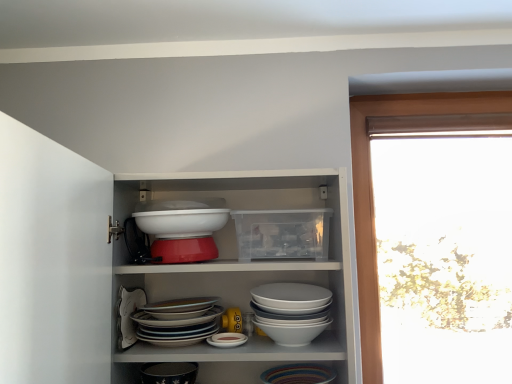
The height and width of the screenshot is (384, 512). What do you see at coordinates (169, 373) in the screenshot?
I see `matte black bowl at lower center` at bounding box center [169, 373].

What is the approximate height of matte black bowl at lower center?

It is 2.81 inches.

Locate an element on the screen. Image resolution: width=512 pixels, height=384 pixels. white glossy bowl at center, which appears as the 3th bowl when ordered from the bottom is located at coordinates (181, 222).

The image size is (512, 384). What do you see at coordinates (291, 311) in the screenshot?
I see `white glossy bowls at center, the 2th bowl when ordered from top to bottom` at bounding box center [291, 311].

You are a GUI agent. You are given a task and a screenshot of the screen. Output one action in this format:
    pyautogui.click(x=<x>, y=<y>)
    Task: Click on the white glossy bowl at center, the 3th bowl in the top-to-bottom sequence
    Image resolution: width=512 pixels, height=384 pixels.
    Given the screenshot: What is the action you would take?
    pyautogui.click(x=177, y=327)

Where is `matte black bowl at lower center`? matte black bowl at lower center is located at coordinates (169, 373).

How different are the orientations of matte black bowl at lower center and white glossy bowl at center, the 3th bowl in the top-to-bottom sequence, in degrees?

0.000886 degrees.

How much distance is there between matte black bowl at lower center and white glossy bowl at center, the 3th bowl in the top-to-bottom sequence?

matte black bowl at lower center is 9.70 centimeters from white glossy bowl at center, the 3th bowl in the top-to-bottom sequence.

From the image's perspective, which object appears higher, matte black bowl at lower center or white glossy bowl at center, the 3th bowl in the top-to-bottom sequence?

white glossy bowl at center, the 3th bowl in the top-to-bottom sequence.

Consider the image. Can we say matte black bowl at lower center lies outside white glossy bowl at center, which ranks as the 1th bowl in bottom-to-top order?

Yes, matte black bowl at lower center is outside of white glossy bowl at center, which ranks as the 1th bowl in bottom-to-top order.

From the image's perspective, is white glossy bowl at center, which ranks as the 1th bowl in bottom-to-top order, located above matte black bowl at lower center?

Yes, from the image's perspective, white glossy bowl at center, which ranks as the 1th bowl in bottom-to-top order, is over matte black bowl at lower center.

Considering the relative sizes of white glossy bowl at center, which ranks as the 1th bowl in bottom-to-top order, and matte black bowl at lower center in the image provided, is white glossy bowl at center, which ranks as the 1th bowl in bottom-to-top order, taller than matte black bowl at lower center?

Yes.

Does white glossy bowl at center, which ranks as the 1th bowl in bottom-to-top order, come in front of matte black bowl at lower center?

Yes, white glossy bowl at center, which ranks as the 1th bowl in bottom-to-top order, is closer to the camera.

Looking at the image, does white glossy bowl at center, the 3th bowl in the top-to-bottom sequence, seem bigger or smaller compared to matte black bowl at lower center?

white glossy bowl at center, the 3th bowl in the top-to-bottom sequence, is bigger than matte black bowl at lower center.

Can you confirm if matte black bowl at lower center is taller than white glossy bowl at center, which appears as the 3th bowl when ordered from the bottom?

No, matte black bowl at lower center is not taller than white glossy bowl at center, which appears as the 3th bowl when ordered from the bottom.

From the image's perspective, is matte black bowl at lower center under white glossy bowl at center, which appears as the 3th bowl when ordered from the bottom?

Indeed, from the image's perspective, matte black bowl at lower center is shown beneath white glossy bowl at center, which appears as the 3th bowl when ordered from the bottom.

Which object is positioned more to the left, matte black bowl at lower center or white glossy bowl at center, marked as the 1th bowl in a top-to-bottom arrangement?

matte black bowl at lower center.

There is a matte black bowl at lower center. At what (x,y) coordinates should I click in order to perform the action: click on the 3rd bowl above it (from a real-world perspective). Please return your answer as a coordinate pair (x, y). The height and width of the screenshot is (384, 512). Looking at the image, I should click on (181, 222).

Could you measure the distance between white glossy bowl at center, the 3th bowl in the top-to-bottom sequence, and white glossy bowl at center, marked as the 1th bowl in a top-to-bottom arrangement?

white glossy bowl at center, the 3th bowl in the top-to-bottom sequence, is 9.50 inches from white glossy bowl at center, marked as the 1th bowl in a top-to-bottom arrangement.

Based on their sizes in the image, would you say white glossy bowl at center, the 3th bowl in the top-to-bottom sequence, is bigger or smaller than white glossy bowl at center, marked as the 1th bowl in a top-to-bottom arrangement?

In the image, white glossy bowl at center, the 3th bowl in the top-to-bottom sequence, appears to be larger than white glossy bowl at center, marked as the 1th bowl in a top-to-bottom arrangement.

Does white glossy bowl at center, which ranks as the 1th bowl in bottom-to-top order, appear on the right side of white glossy bowl at center, marked as the 1th bowl in a top-to-bottom arrangement?

No.

From the image's perspective, is white glossy bowl at center, the 3th bowl in the top-to-bottom sequence, positioned above or below white glossy bowl at center, which appears as the 3th bowl when ordered from the bottom?

From the image's perspective, white glossy bowl at center, the 3th bowl in the top-to-bottom sequence, appears below white glossy bowl at center, which appears as the 3th bowl when ordered from the bottom.

Which is behind, white glossy bowl at center, which ranks as the 1th bowl in bottom-to-top order, or white glossy bowls at center, the 2th bowl when ordered from top to bottom?

white glossy bowl at center, which ranks as the 1th bowl in bottom-to-top order, is more distant.

From the image's perspective, is white glossy bowl at center, the 3th bowl in the top-to-bottom sequence, located beneath white glossy bowls at center, the 2th bowl when ordered from top to bottom?

Yes, from the image's perspective, white glossy bowl at center, the 3th bowl in the top-to-bottom sequence, is beneath white glossy bowls at center, the 2th bowl when ordered from top to bottom.

Considering the relative sizes of white glossy bowl at center, the 3th bowl in the top-to-bottom sequence, and white glossy bowls at center, acting as the 2th bowl starting from the bottom, in the image provided, is white glossy bowl at center, the 3th bowl in the top-to-bottom sequence, shorter than white glossy bowls at center, acting as the 2th bowl starting from the bottom,?

Correct, white glossy bowl at center, the 3th bowl in the top-to-bottom sequence, is not as tall as white glossy bowls at center, acting as the 2th bowl starting from the bottom.

Does white glossy bowl at center, which ranks as the 1th bowl in bottom-to-top order, have a smaller size compared to white glossy bowls at center, acting as the 2th bowl starting from the bottom?

No.

Which object is further away from the camera taking this photo, white glossy bowls at center, acting as the 2th bowl starting from the bottom, or white glossy bowl at center, the 3th bowl in the top-to-bottom sequence?

white glossy bowl at center, the 3th bowl in the top-to-bottom sequence, is behind.

From the image's perspective, which one is positioned lower, white glossy bowls at center, acting as the 2th bowl starting from the bottom, or white glossy bowl at center, which ranks as the 1th bowl in bottom-to-top order?

white glossy bowl at center, which ranks as the 1th bowl in bottom-to-top order, is shown below in the image.

From a real-world perspective, which object rests below the other?

white glossy bowl at center, the 3th bowl in the top-to-bottom sequence, from a real-world perspective.

Which of these two, white glossy bowl at center, which appears as the 3th bowl when ordered from the bottom, or white glossy bowl at center, which ranks as the 1th bowl in bottom-to-top order, is bigger?

Bigger between the two is white glossy bowl at center, which ranks as the 1th bowl in bottom-to-top order.

From their relative heights in the image, would you say white glossy bowl at center, marked as the 1th bowl in a top-to-bottom arrangement, is taller or shorter than white glossy bowl at center, the 3th bowl in the top-to-bottom sequence?

Considering their sizes, white glossy bowl at center, marked as the 1th bowl in a top-to-bottom arrangement, has less height than white glossy bowl at center, the 3th bowl in the top-to-bottom sequence.

How far apart are white glossy bowl at center, which appears as the 3th bowl when ordered from the bottom, and white glossy bowl at center, which ranks as the 1th bowl in bottom-to-top order?

white glossy bowl at center, which appears as the 3th bowl when ordered from the bottom, and white glossy bowl at center, which ranks as the 1th bowl in bottom-to-top order, are 24.13 centimeters apart.

How many degrees apart are the facing directions of white glossy bowl at center, marked as the 1th bowl in a top-to-bottom arrangement, and white glossy bowl at center, which ranks as the 1th bowl in bottom-to-top order?

The angle between the facing direction of white glossy bowl at center, marked as the 1th bowl in a top-to-bottom arrangement, and the facing direction of white glossy bowl at center, which ranks as the 1th bowl in bottom-to-top order, is 0.00082 degrees.

From the image's perspective, which bowl is the 1st one above the matte black bowl at lower center? Please provide its 2D coordinates.

[(177, 327)]

Find the location of a particular element. The image size is (512, 384). tableware below the white glossy bowl at center, the 3th bowl in the top-to-bottom sequence (from a real-world perspective) is located at coordinates (169, 373).

In the scene shown: Looking at the image, which one is located closer to white glossy bowl at center, marked as the 1th bowl in a top-to-bottom arrangement, white glossy bowl at center, the 3th bowl in the top-to-bottom sequence, or white glossy bowls at center, the 2th bowl when ordered from top to bottom?

Among the two, white glossy bowl at center, the 3th bowl in the top-to-bottom sequence, is located nearer to white glossy bowl at center, marked as the 1th bowl in a top-to-bottom arrangement.

Based on their spatial positions, is white glossy bowl at center, which appears as the 3th bowl when ordered from the bottom, or white glossy bowls at center, the 2th bowl when ordered from top to bottom, closer to white glossy bowl at center, which ranks as the 1th bowl in bottom-to-top order?

The object closer to white glossy bowl at center, which ranks as the 1th bowl in bottom-to-top order, is white glossy bowls at center, the 2th bowl when ordered from top to bottom.

Which object lies further to the anchor point white glossy bowl at center, which ranks as the 1th bowl in bottom-to-top order, white glossy bowls at center, the 2th bowl when ordered from top to bottom, or white glossy bowl at center, which appears as the 3th bowl when ordered from the bottom?

The object further to white glossy bowl at center, which ranks as the 1th bowl in bottom-to-top order, is white glossy bowl at center, which appears as the 3th bowl when ordered from the bottom.

Looking at the image, which one is located further to white glossy bowl at center, marked as the 1th bowl in a top-to-bottom arrangement, white glossy bowls at center, acting as the 2th bowl starting from the bottom, or matte black bowl at lower center?

Among the two, matte black bowl at lower center is located further to white glossy bowl at center, marked as the 1th bowl in a top-to-bottom arrangement.

Considering their positions, is white glossy bowl at center, which appears as the 3th bowl when ordered from the bottom, positioned closer to white glossy bowls at center, acting as the 2th bowl starting from the bottom, than white glossy bowl at center, the 3th bowl in the top-to-bottom sequence?

The object closer to white glossy bowls at center, acting as the 2th bowl starting from the bottom, is white glossy bowl at center, the 3th bowl in the top-to-bottom sequence.

When comparing their distances from matte black bowl at lower center, does white glossy bowls at center, acting as the 2th bowl starting from the bottom, or white glossy bowl at center, the 3th bowl in the top-to-bottom sequence, seem closer?

Among the two, white glossy bowl at center, the 3th bowl in the top-to-bottom sequence, is located nearer to matte black bowl at lower center.

Estimate the real-world distances between objects in this image. Which object is further from white glossy bowls at center, acting as the 2th bowl starting from the bottom, matte black bowl at lower center or white glossy bowl at center, which ranks as the 1th bowl in bottom-to-top order?

Based on the image, matte black bowl at lower center appears to be further to white glossy bowls at center, acting as the 2th bowl starting from the bottom.

Considering their positions, is matte black bowl at lower center positioned closer to white glossy bowl at center, which appears as the 3th bowl when ordered from the bottom, than white glossy bowl at center, the 3th bowl in the top-to-bottom sequence?

Among the two, white glossy bowl at center, the 3th bowl in the top-to-bottom sequence, is located nearer to white glossy bowl at center, which appears as the 3th bowl when ordered from the bottom.

Where is `bowl between white glossy bowl at center, the 3th bowl in the top-to-bottom sequence, and white glossy bowls at center, the 2th bowl when ordered from top to bottom`? bowl between white glossy bowl at center, the 3th bowl in the top-to-bottom sequence, and white glossy bowls at center, the 2th bowl when ordered from top to bottom is located at coordinates (181, 222).